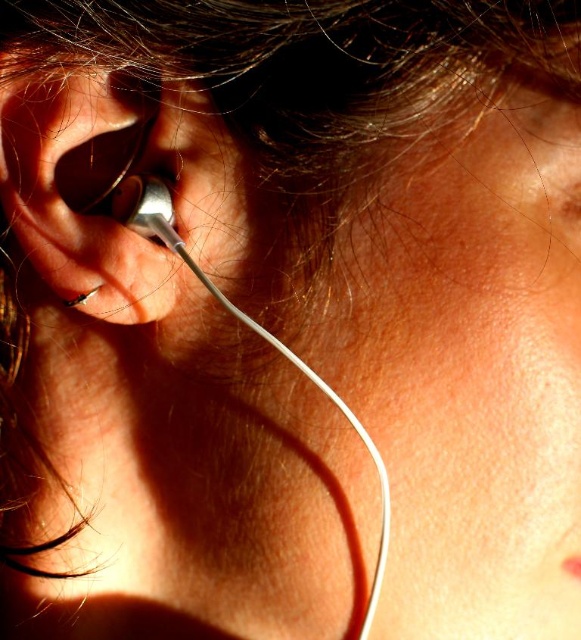
You are standing 20 inches away from the image. Is the point at coordinates point (49, 99) closer to you than the rest of the image?

The distance of point (49, 99) from viewer is 21.13 inches, so if you are standing 20 inches away from the image, the point is slightly farther away than your current position, meaning it is not closer to you than the rest of the image.

You are a photographer adjusting the lighting for a closeup shot of the ear and neck area. You notice the silver metallic earbud at left and the silver metallic earring at left. Which of these two items is positioned higher on the left side of the ear?

The silver metallic earbud at left is located above the silver metallic earring at left, so it is positioned higher on the left side of the ear.

Based on the photo, you are a stylist preparing to style someone with the silver metallic earbud at left and the silver metallic earring at left. Which of the two items is more suitable for a minimalist look that requires subtle details?

The silver metallic earbud at left is thinner than the silver metallic earring at left, making it a better choice for a minimalist look that emphasizes subtle details.